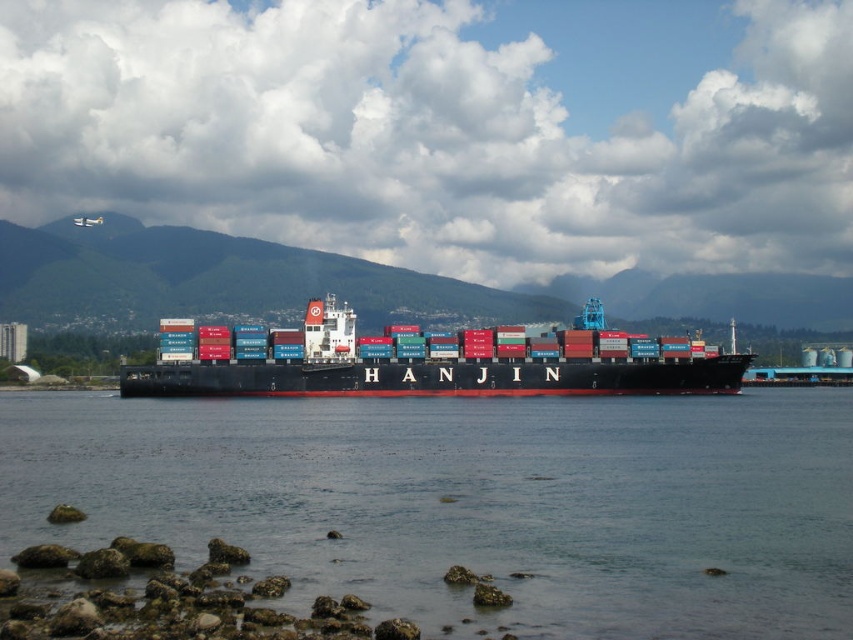
Between clear water at center and red matte container ship at center, which one appears on the right side from the viewer's perspective?

clear water at center

Does point (682, 442) come behind point (712, 372)?

That is False.

You are a GUI agent. You are given a task and a screenshot of the screen. Output one action in this format:
    pyautogui.click(x=<x>, y=<y>)
    Task: Click on the clear water at center
    
    Given the screenshot: What is the action you would take?
    pyautogui.click(x=471, y=500)

This screenshot has height=640, width=853. Find the location of `clear water at center`. clear water at center is located at coordinates [x=471, y=500].